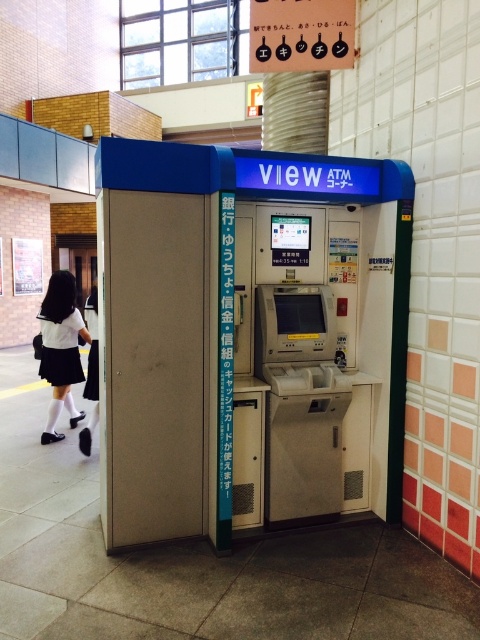
Does point (249, 349) come farther from viewer compared to point (61, 433)?

No.

Is point (152, 452) closer to camera compared to point (60, 307)?

Yes, it is in front of point (60, 307).

At what (x,y) coordinates should I click in order to perform the action: click on matte plastic atm at center. Please return your answer as a coordinate pair (x, y). This screenshot has height=640, width=480. Looking at the image, I should click on (245, 336).